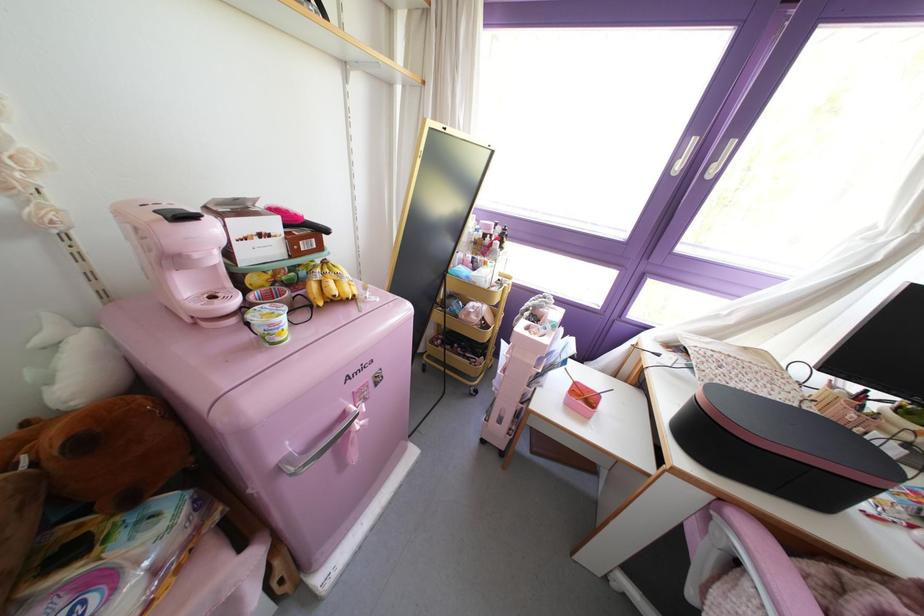
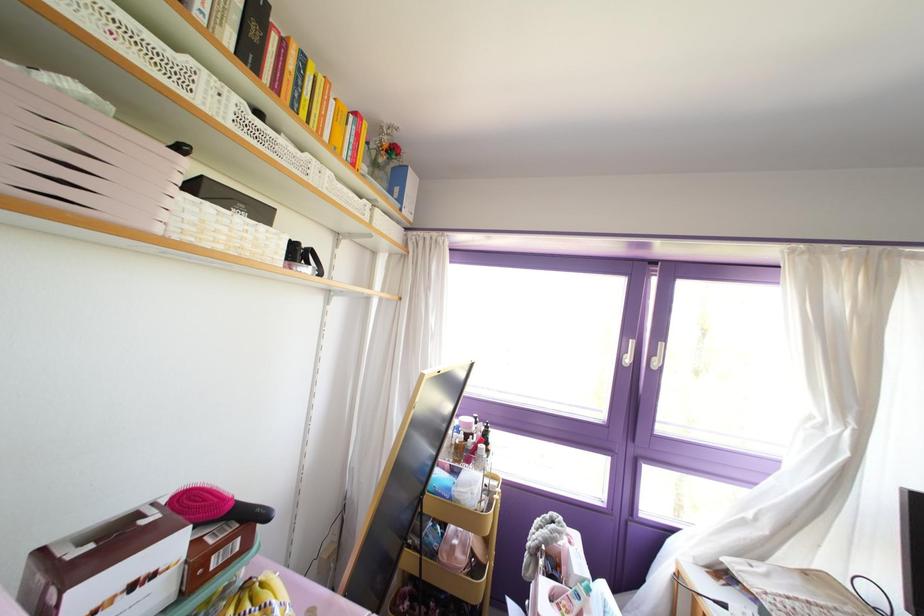
Locate, in the second image, the point that corresponds to point (677, 167) in the first image.

(626, 360)